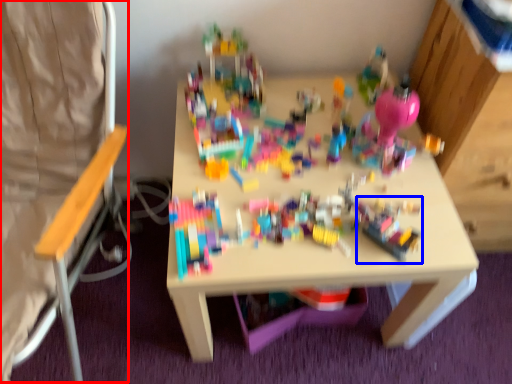
Question: Among these objects, which one is nearest to the camera, folding chair (highlighted by a red box) or toy (highlighted by a blue box)?

Choices:
 (A) folding chair
 (B) toy

Answer: (A)